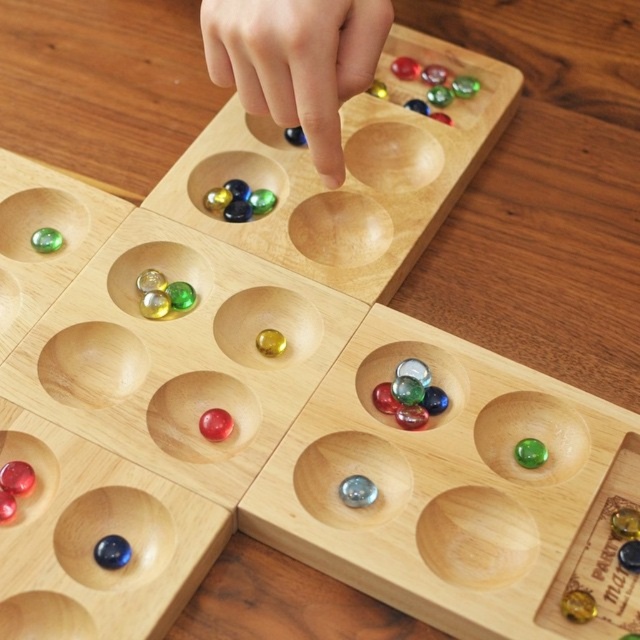
Is smooth skin hand at upper center thinner than green glass marble at lower right?

No, smooth skin hand at upper center is not thinner than green glass marble at lower right.

Is smooth skin hand at upper center taller than green glass marble at lower right?

Yes, smooth skin hand at upper center is taller than green glass marble at lower right.

Locate an element on the screen. smooth skin hand at upper center is located at coordinates (296, 61).

The width and height of the screenshot is (640, 640). Find the location of `shiny red marble at lower left`. shiny red marble at lower left is located at coordinates (13, 486).

Is point (13, 470) positioned after point (541, 461)?

That is False.

Is point (8, 465) in front of point (545, 460)?

Yes, point (8, 465) is in front of point (545, 460).

You are a GUI agent. You are given a task and a screenshot of the screen. Output one action in this format:
    pyautogui.click(x=<x>, y=<y>)
    Task: Click on the shiny red marble at lower left
    
    Given the screenshot: What is the action you would take?
    pyautogui.click(x=13, y=486)

Based on the photo, is translucent glass marbles at center to the right of translucent red marble at center from the viewer's perspective?

Yes, translucent glass marbles at center is to the right of translucent red marble at center.

Is translucent glass marbles at center shorter than translucent red marble at center?

Incorrect, translucent glass marbles at center's height does not fall short of translucent red marble at center's.

The height and width of the screenshot is (640, 640). I want to click on translucent glass marbles at center, so click(410, 396).